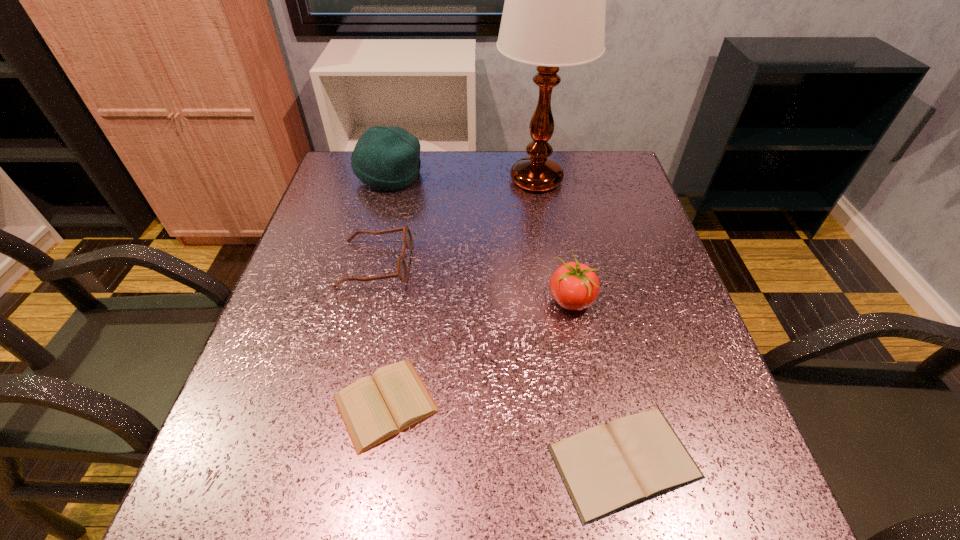
Find the location of a particular element. This screenshot has width=960, height=540. vacant space that satisfies the following two spatial constraints: 1. on the back side of the Bible; 2. on the front-facing side of the fourth tallest object is located at coordinates (580, 264).

This screenshot has width=960, height=540. I want to click on vacant region that satisfies the following two spatial constraints: 1. on the front side of the tomato; 2. on the left side of the beanie, so click(358, 300).

The height and width of the screenshot is (540, 960). Identify the location of blank space that satisfies the following two spatial constraints: 1. on the back side of the third tallest object; 2. on the right side of the diary. (402, 300).